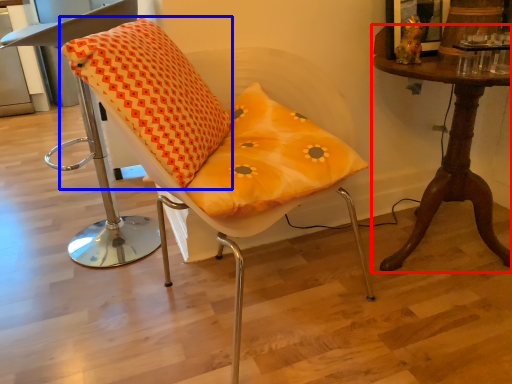
Question: Which point is further to the camera, table (highlighted by a red box) or throw pillow (highlighted by a blue box)?

Choices:
 (A) table
 (B) throw pillow

Answer: (A)